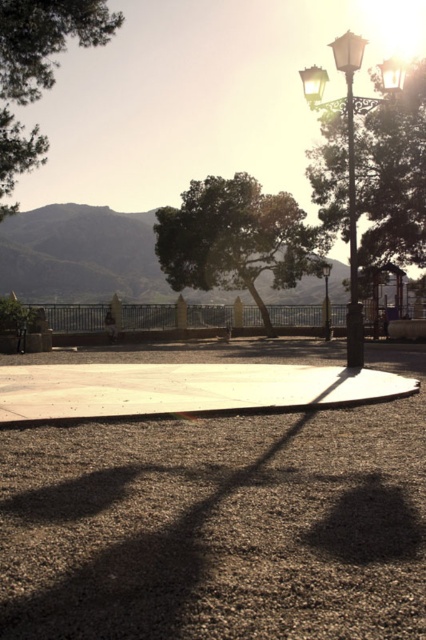
Which is behind, point (328, 237) or point (362, 339)?

Positioned behind is point (328, 237).

Locate an element on the screen. The image size is (426, 640). green leafy tree at center is located at coordinates (236, 237).

Locate an element on the screen. The height and width of the screenshot is (640, 426). green leafy tree at center is located at coordinates (236, 237).

Can you confirm if metallic streetlight at upper right is bigger than metallic streetlight at center?

Yes.

Which of these two, metallic streetlight at upper right or metallic streetlight at center, stands taller?

With more height is metallic streetlight at upper right.

Locate an element on the screen. The height and width of the screenshot is (640, 426). metallic streetlight at upper right is located at coordinates (353, 244).

At what (x,y) coordinates should I click in order to perform the action: click on metallic streetlight at upper right. Please return your answer as a coordinate pair (x, y). Looking at the image, I should click on (353, 244).

Is green leafy tree at center shorter than green leafy tree at upper left?

Incorrect, green leafy tree at center's height does not fall short of green leafy tree at upper left's.

Image resolution: width=426 pixels, height=640 pixels. Describe the element at coordinates (236, 237) in the screenshot. I see `green leafy tree at center` at that location.

Locate an element on the screen. green leafy tree at center is located at coordinates pos(236,237).